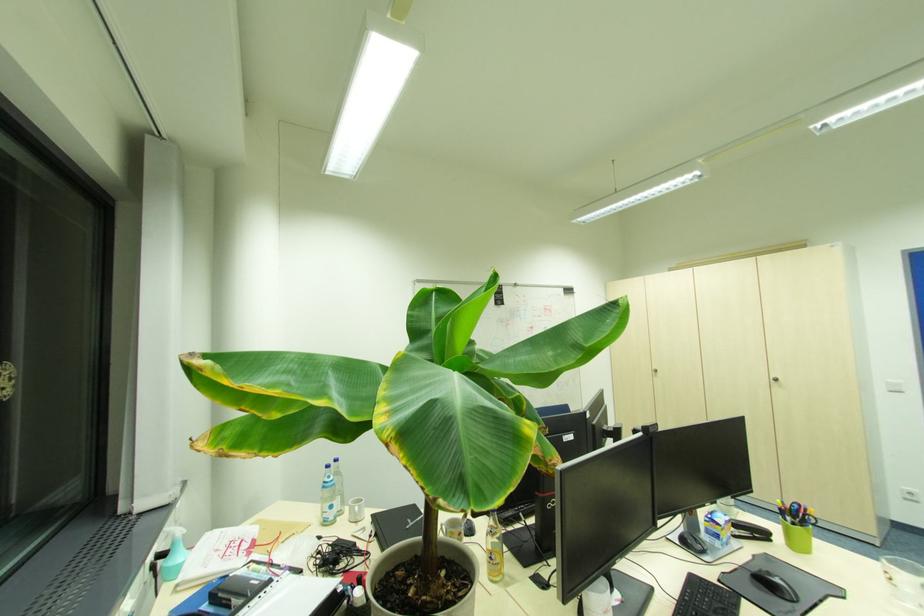
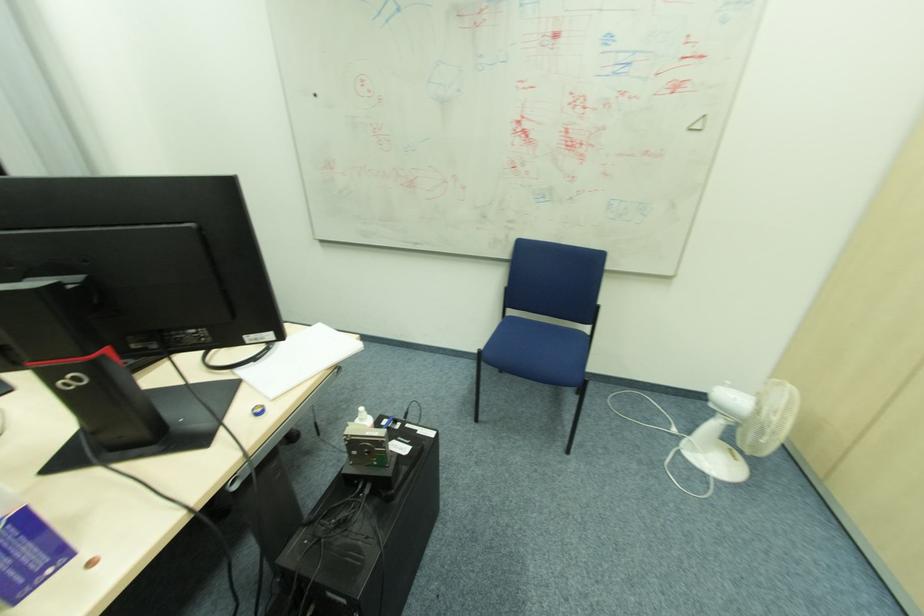
Question: I am providing you with two images of the same scene from different viewpoints. After the viewpoint changes to image2, which objects are now occluded?

Choices:
 (A) white paper cup
 (B) white pump bottle
 (C) lower dryer door
 (D) white portable fan switch

Answer: (A)